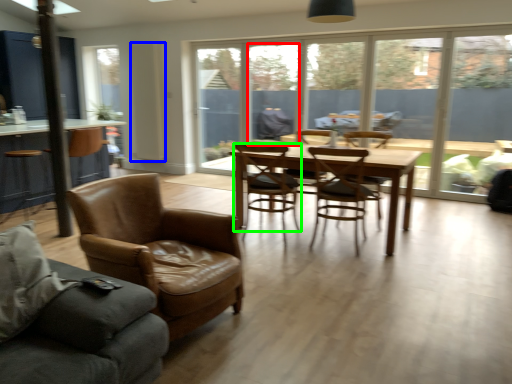
Question: Which is nearer to the window (highlighted by a red box)? screen door (highlighted by a blue box) or chair (highlighted by a green box).

Choices:
 (A) screen door
 (B) chair

Answer: (A)